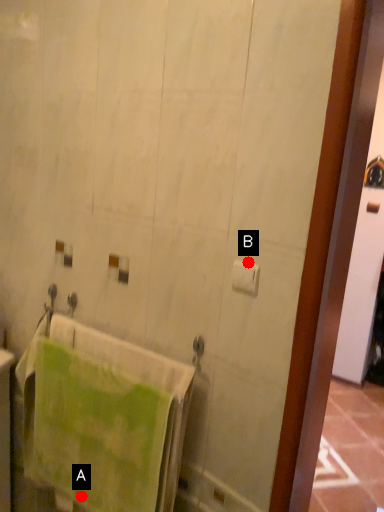
Question: Two points are circled on the image, labeled by A and B beside each circle. Which point appears closest to the camera in this image?

Choices:
 (A) A is closer
 (B) B is closer

Answer: (B)